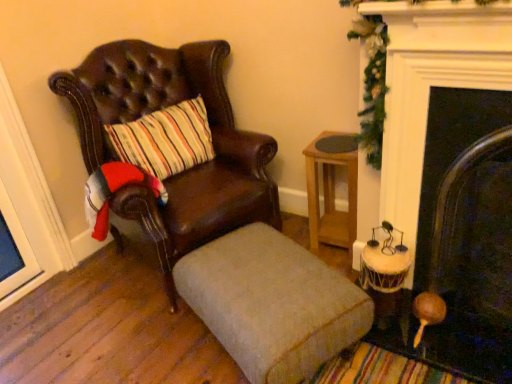
Question: Considering the relative positions of beige fabric ottoman at center and green garland at upper right in the image provided, is beige fabric ottoman at center to the right of green garland at upper right from the viewer's perspective?

Choices:
 (A) yes
 (B) no

Answer: (B)

Question: Are beige fabric ottoman at center and green garland at upper right far apart?

Choices:
 (A) yes
 (B) no

Answer: (B)

Question: Is the depth of beige fabric ottoman at center less than that of green garland at upper right?

Choices:
 (A) yes
 (B) no

Answer: (A)

Question: Is beige fabric ottoman at center facing towards green garland at upper right?

Choices:
 (A) yes
 (B) no

Answer: (B)

Question: From a real-world perspective, is beige fabric ottoman at center on top of green garland at upper right?

Choices:
 (A) yes
 (B) no

Answer: (B)

Question: From a real-world perspective, relative to green garland at upper right, is light brown wooden table at center-right vertically above or below?

Choices:
 (A) above
 (B) below

Answer: (B)

Question: From the image's perspective, relative to green garland at upper right, is light brown wooden table at center-right above or below?

Choices:
 (A) above
 (B) below

Answer: (B)

Question: Looking at their shapes, would you say light brown wooden table at center-right is wider or thinner than green garland at upper right?

Choices:
 (A) wide
 (B) thin

Answer: (A)

Question: Is light brown wooden table at center-right taller or shorter than green garland at upper right?

Choices:
 (A) short
 (B) tall

Answer: (A)

Question: Considering their positions, is dark wood fireplace at right located in front of or behind light brown wooden table at center-right?

Choices:
 (A) front
 (B) behind

Answer: (A)

Question: Considering the positions of dark wood fireplace at right and light brown wooden table at center-right in the image, is dark wood fireplace at right wider or thinner than light brown wooden table at center-right?

Choices:
 (A) thin
 (B) wide

Answer: (A)

Question: From a real-world perspective, relative to light brown wooden table at center-right, is dark wood fireplace at right vertically above or below?

Choices:
 (A) above
 (B) below

Answer: (A)

Question: Is dark wood fireplace at right inside the boundaries of light brown wooden table at center-right, or outside?

Choices:
 (A) inside
 (B) outside

Answer: (B)

Question: In the image, is leather chair at left positioned in front of or behind dark wood fireplace at right?

Choices:
 (A) behind
 (B) front

Answer: (A)

Question: Looking at their shapes, would you say leather chair at left is wider or thinner than dark wood fireplace at right?

Choices:
 (A) wide
 (B) thin

Answer: (A)